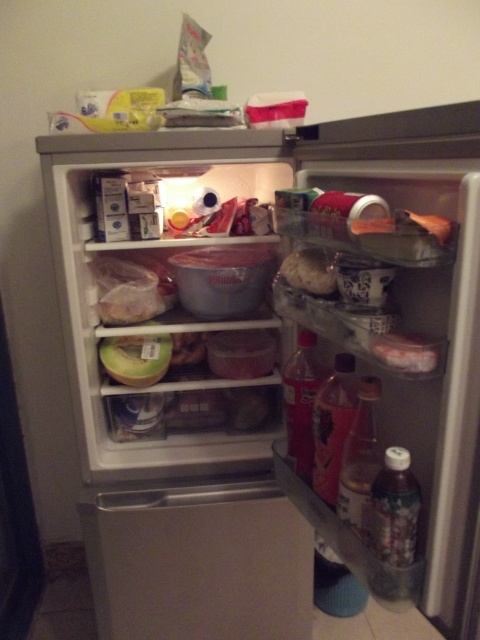
Looking at this image, does translucent plastic bottle at lower right appear under green plastic container at center?

Indeed, translucent plastic bottle at lower right is positioned under green plastic container at center.

Between translucent plastic bottle at lower right and green plastic container at center, which one appears on the right side from the viewer's perspective?

From the viewer's perspective, translucent plastic bottle at lower right appears more on the right side.

Find the location of a particular element. The height and width of the screenshot is (640, 480). translucent plastic bottle at lower right is located at coordinates (395, 528).

The width and height of the screenshot is (480, 640). Identify the location of translucent plastic bottle at lower right. (395, 528).

Does translucent plastic soda at center have a larger size compared to translucent plastic bottle at center?

No.

Is translucent plastic soda at center below translucent plastic bottle at center?

Correct, translucent plastic soda at center is located below translucent plastic bottle at center.

Is point (320, 467) farther from camera compared to point (300, 445)?

No, (320, 467) is in front of (300, 445).

Locate an element on the screen. translucent plastic soda at center is located at coordinates (333, 424).

What do you see at coordinates (395, 528) in the screenshot? The width and height of the screenshot is (480, 640). I see `translucent plastic bottle at lower right` at bounding box center [395, 528].

Who is taller, translucent plastic bottle at lower right or translucent plastic container at center?

With more height is translucent plastic bottle at lower right.

Where is `translucent plastic bottle at lower right`? translucent plastic bottle at lower right is located at coordinates (395, 528).